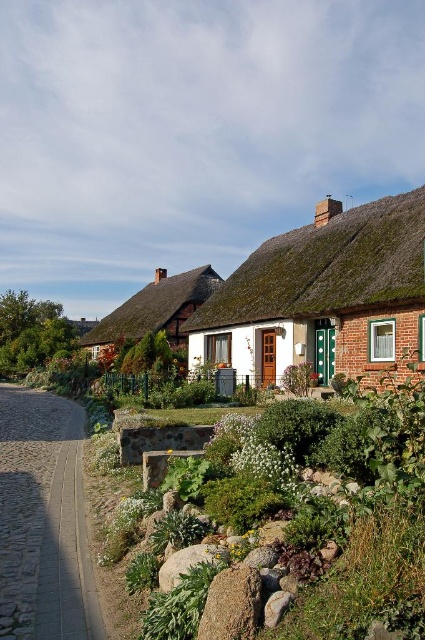
Question: Estimate the real-world distances between objects in this image. Which object is closer to the paved stone path at lower left?

Choices:
 (A) thatched roof at upper center
 (B) thatched roof cottage at center

Answer: (A)

Question: Does green stone bench at center come behind thatched roof house at center?

Choices:
 (A) no
 (B) yes

Answer: (A)

Question: Among these points, which one is farthest from the camera?

Choices:
 (A) (340, 291)
 (B) (345, 515)

Answer: (A)

Question: Which point is farther from the camera taking this photo?

Choices:
 (A) (385, 586)
 (B) (133, 342)
 (C) (265, 310)

Answer: (B)

Question: Is thatched roof house at center smaller than paved stone path at lower left?

Choices:
 (A) no
 (B) yes

Answer: (A)

Question: In this image, where is thatched roof house at center located relative to thatched roof cottage at center?

Choices:
 (A) above
 (B) below

Answer: (A)